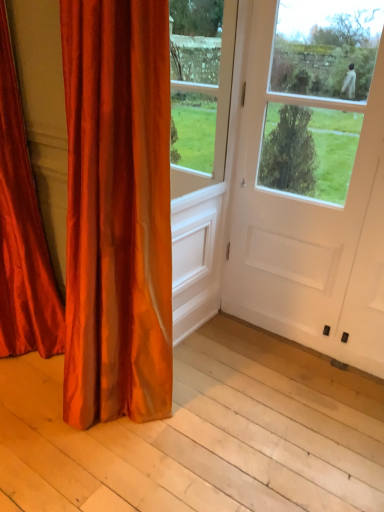
Measure the distance between point (1, 132) and camera.

1.58 meters.

Locate an element on the screen. satin red curtain at left, placed as the second curtain when sorted from right to left is located at coordinates (22, 232).

Describe the element at coordinates (311, 183) in the screenshot. I see `white matte door at center` at that location.

In order to face satin orange curtain at left, the 2th curtain positioned from the left, should I rotate leftwards or rightwards?

Rotate your view left by about 11.502°.

Find the location of `satin red curtain at left, which ranks as the first curtain in left-to-right order`. satin red curtain at left, which ranks as the first curtain in left-to-right order is located at coordinates (22, 232).

Is white matte door at center oriented away from satin red curtain at left, placed as the second curtain when sorted from right to left?

white matte door at center does not have its back to satin red curtain at left, placed as the second curtain when sorted from right to left.

Considering their positions, is white matte door at center located in front of or behind satin red curtain at left, which ranks as the first curtain in left-to-right order?

Visually, white matte door at center is located behind satin red curtain at left, which ranks as the first curtain in left-to-right order.

In the scene shown: Is white matte door at center smaller than satin red curtain at left, placed as the second curtain when sorted from right to left?

Yes, white matte door at center is smaller than satin red curtain at left, placed as the second curtain when sorted from right to left.

What's the angular difference between white matte door at center and satin red curtain at left, placed as the second curtain when sorted from right to left,'s facing directions?

They differ by 2 degrees in their facing directions.

Which of these two, smooth wood plank at lower left or satin red curtain at left, placed as the second curtain when sorted from right to left, is bigger?

Bigger between the two is satin red curtain at left, placed as the second curtain when sorted from right to left.

In the scene shown: From a real-world perspective, does smooth wood plank at lower left sit lower than satin red curtain at left, which ranks as the first curtain in left-to-right order?

Yes.

Is smooth wood plank at lower left to the left or to the right of satin red curtain at left, placed as the second curtain when sorted from right to left, in the image?

In the image, smooth wood plank at lower left appears on the right side of satin red curtain at left, placed as the second curtain when sorted from right to left.

Between satin orange curtain at left, which appears as the first curtain when viewed from the right, and white matte door at center, which one has smaller size?

Smaller between the two is white matte door at center.

Between satin orange curtain at left, which appears as the first curtain when viewed from the right, and white matte door at center, which one is positioned behind?

white matte door at center is more distant.

From a real-world perspective, starting from the white matte door at center, which curtain is the 2nd one below it? Please provide its 2D coordinates.

[(117, 211)]

How many degrees apart are the facing directions of white matte door at center and satin orange curtain at left, the 2th curtain positioned from the left?

0.806 degrees separate the facing orientations of white matte door at center and satin orange curtain at left, the 2th curtain positioned from the left.

From the image's perspective, which is above, white matte door at center or satin orange curtain at left, the 2th curtain positioned from the left?

white matte door at center is shown above in the image.

Is there a large distance between white matte door at center and satin orange curtain at left, which appears as the first curtain when viewed from the right?

No, there isn't a large distance between white matte door at center and satin orange curtain at left, which appears as the first curtain when viewed from the right.

From a real-world perspective, between white matte door at center and satin orange curtain at left, the 2th curtain positioned from the left, who is vertically higher?

In real-world perspective, white matte door at center is above.

Is smooth wood plank at lower left in contact with satin orange curtain at left, which appears as the first curtain when viewed from the right?

smooth wood plank at lower left and satin orange curtain at left, which appears as the first curtain when viewed from the right, are not in contact.

Would you say smooth wood plank at lower left is inside or outside satin orange curtain at left, which appears as the first curtain when viewed from the right?

smooth wood plank at lower left is not inside satin orange curtain at left, which appears as the first curtain when viewed from the right, it's outside.

In the scene shown: Which of these two, smooth wood plank at lower left or satin orange curtain at left, the 2th curtain positioned from the left, is thinner?

satin orange curtain at left, the 2th curtain positioned from the left.

Which object is closer to the camera taking this photo, smooth wood plank at lower left or satin orange curtain at left, the 2th curtain positioned from the left?

satin orange curtain at left, the 2th curtain positioned from the left, is more forward.

In the image, is satin red curtain at left, which ranks as the first curtain in left-to-right order, positioned in front of or behind smooth wood plank at lower left?

satin red curtain at left, which ranks as the first curtain in left-to-right order, is positioned farther from the viewer than smooth wood plank at lower left.

Which is behind, point (29, 260) or point (179, 481)?

Positioned behind is point (29, 260).

From a real-world perspective, which object rests below the other?

From a 3D spatial view, smooth wood plank at lower left is below.

From the image's perspective, relative to smooth wood plank at lower left, is satin red curtain at left, placed as the second curtain when sorted from right to left, above or below?

Based on their image positions, satin red curtain at left, placed as the second curtain when sorted from right to left, is located above smooth wood plank at lower left.

Consider the image. Considering the relative positions of white matte door at center and smooth wood plank at lower left in the image provided, is white matte door at center to the left of smooth wood plank at lower left from the viewer's perspective?

Incorrect, white matte door at center is not on the left side of smooth wood plank at lower left.

Does white matte door at center have a smaller size compared to smooth wood plank at lower left?

Yes, white matte door at center is smaller than smooth wood plank at lower left.

Who is shorter, white matte door at center or smooth wood plank at lower left?

Standing shorter between the two is smooth wood plank at lower left.

From a real-world perspective, is white matte door at center above or below smooth wood plank at lower left?

From a real-world perspective, white matte door at center is physically above smooth wood plank at lower left.

This screenshot has width=384, height=512. In order to click on door above the satin red curtain at left, which ranks as the first curtain in left-to-right order (from the image's perspective) in this screenshot , I will do `click(311, 183)`.

Where is `the 2nd curtain directly above the smooth wood plank at lower left (from a real-world perspective)`? the 2nd curtain directly above the smooth wood plank at lower left (from a real-world perspective) is located at coordinates (22, 232).

Looking at the image, which one is located closer to satin red curtain at left, placed as the second curtain when sorted from right to left, satin orange curtain at left, which appears as the first curtain when viewed from the right, or smooth wood plank at lower left?

The object closer to satin red curtain at left, placed as the second curtain when sorted from right to left, is satin orange curtain at left, which appears as the first curtain when viewed from the right.

Considering their positions, is smooth wood plank at lower left positioned closer to white matte door at center than satin orange curtain at left, which appears as the first curtain when viewed from the right?

Based on the image, smooth wood plank at lower left appears to be nearer to white matte door at center.

Based on their spatial positions, is satin orange curtain at left, which appears as the first curtain when viewed from the right, or white matte door at center closer to satin red curtain at left, placed as the second curtain when sorted from right to left?

The object closer to satin red curtain at left, placed as the second curtain when sorted from right to left, is satin orange curtain at left, which appears as the first curtain when viewed from the right.

Estimate the real-world distances between objects in this image. Which object is further from white matte door at center, satin red curtain at left, which ranks as the first curtain in left-to-right order, or smooth wood plank at lower left?

satin red curtain at left, which ranks as the first curtain in left-to-right order, is further to white matte door at center.

Based on their spatial positions, is smooth wood plank at lower left or satin red curtain at left, placed as the second curtain when sorted from right to left, further from white matte door at center?

satin red curtain at left, placed as the second curtain when sorted from right to left, lies further to white matte door at center than the other object.

When comparing their distances from white matte door at center, does satin red curtain at left, placed as the second curtain when sorted from right to left, or satin orange curtain at left, the 2th curtain positioned from the left, seem further?

satin red curtain at left, placed as the second curtain when sorted from right to left, is positioned further to the anchor white matte door at center.

Estimate the real-world distances between objects in this image. Which object is further from smooth wood plank at lower left, white matte door at center or satin orange curtain at left, which appears as the first curtain when viewed from the right?

white matte door at center is positioned further to the anchor smooth wood plank at lower left.

From the picture: Looking at the image, which one is located further to smooth wood plank at lower left, satin red curtain at left, which ranks as the first curtain in left-to-right order, or white matte door at center?

Based on the image, satin red curtain at left, which ranks as the first curtain in left-to-right order, appears to be further to smooth wood plank at lower left.

Locate an element on the screen. The width and height of the screenshot is (384, 512). plank situated between satin red curtain at left, placed as the second curtain when sorted from right to left, and white matte door at center from left to right is located at coordinates (202, 435).

The height and width of the screenshot is (512, 384). I want to click on curtain located between satin red curtain at left, placed as the second curtain when sorted from right to left, and white matte door at center in the left-right direction, so click(x=117, y=211).

You are a GUI agent. You are given a task and a screenshot of the screen. Output one action in this format:
    pyautogui.click(x=<x>, y=<y>)
    Task: Click on the curtain between satin red curtain at left, placed as the second curtain when sorted from right to left, and smooth wood plank at lower left vertically
    This screenshot has height=512, width=384.
    Given the screenshot: What is the action you would take?
    pyautogui.click(x=117, y=211)